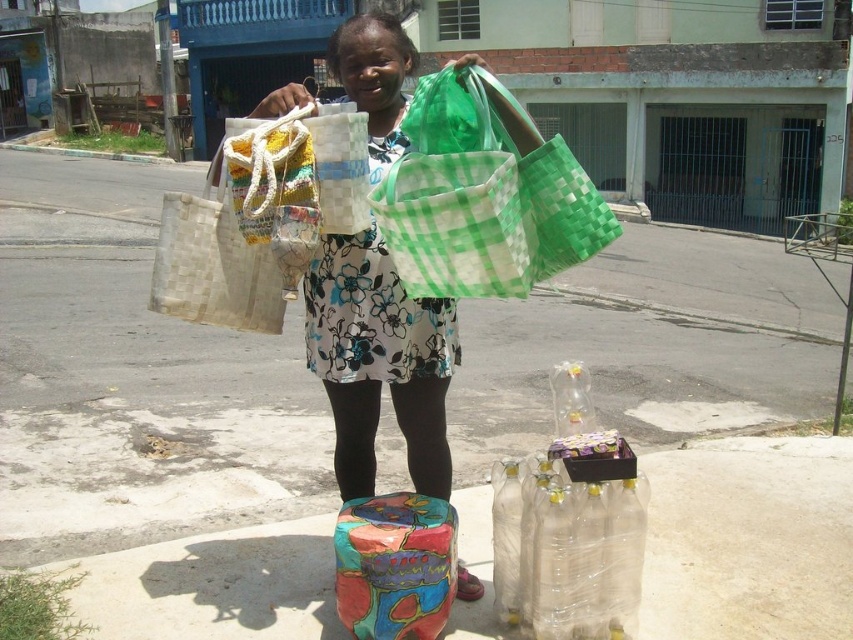
You are a customer at the market and want to choose a bag that is taller. You see the matte woven bags at center and the green woven bag at center. Which one should you pick?

The matte woven bags at center has a greater height compared to the green woven bag at center, so you should pick the matte woven bags at center.